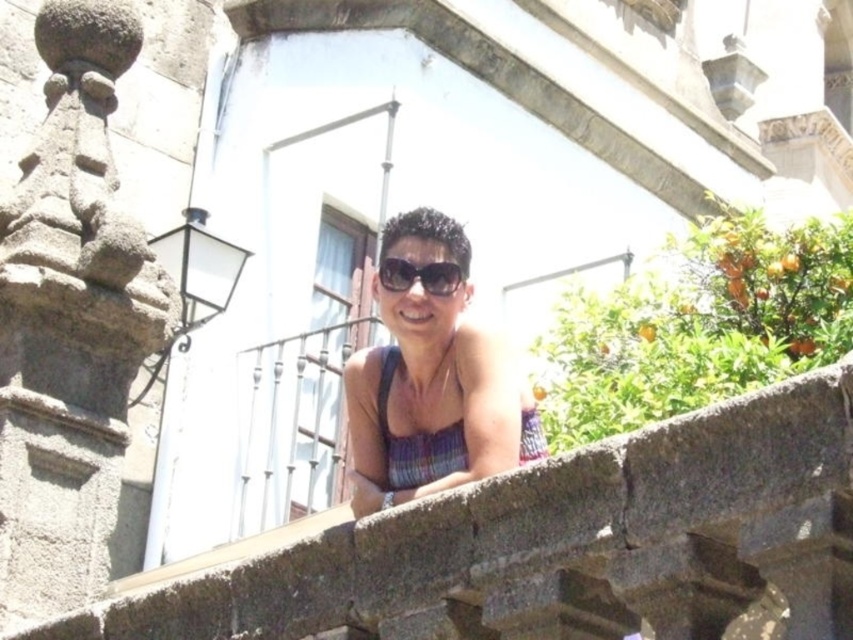
Question: Does multicolored knit bikini top at center appear on the right side of black plastic sunglasses at center?

Choices:
 (A) no
 (B) yes

Answer: (B)

Question: Which object is farther from the camera taking this photo?

Choices:
 (A) matte black tank top at center
 (B) multicolored knit bikini top at center
 (C) green leafy bush at upper right

Answer: (C)

Question: Which point is farther from the camera taking this photo?

Choices:
 (A) (386, 369)
 (B) (445, 260)

Answer: (A)

Question: From the image, what is the correct spatial relationship of rough stone ledge at center in relation to multicolored knit bikini top at center?

Choices:
 (A) right
 (B) left

Answer: (B)

Question: Can you confirm if rough stone ledge at center is thinner than multicolored knit bikini top at center?

Choices:
 (A) no
 (B) yes

Answer: (A)

Question: Which of the following is the closest to the observer?

Choices:
 (A) black plastic sunglasses at center
 (B) green leafy bush at upper right
 (C) rough stone ledge at center

Answer: (C)